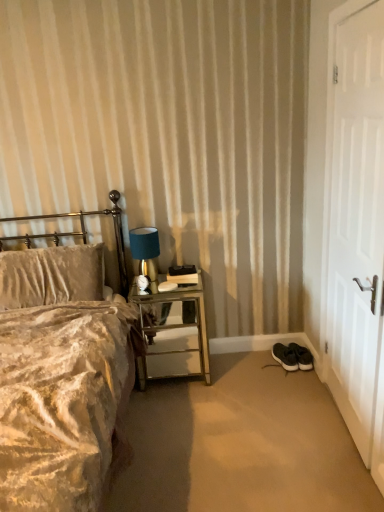
Locate an element on the screen. Image resolution: width=384 pixels, height=512 pixels. vacant area that lies between white matte door at right and mirrored glass nightstand at center is located at coordinates (262, 395).